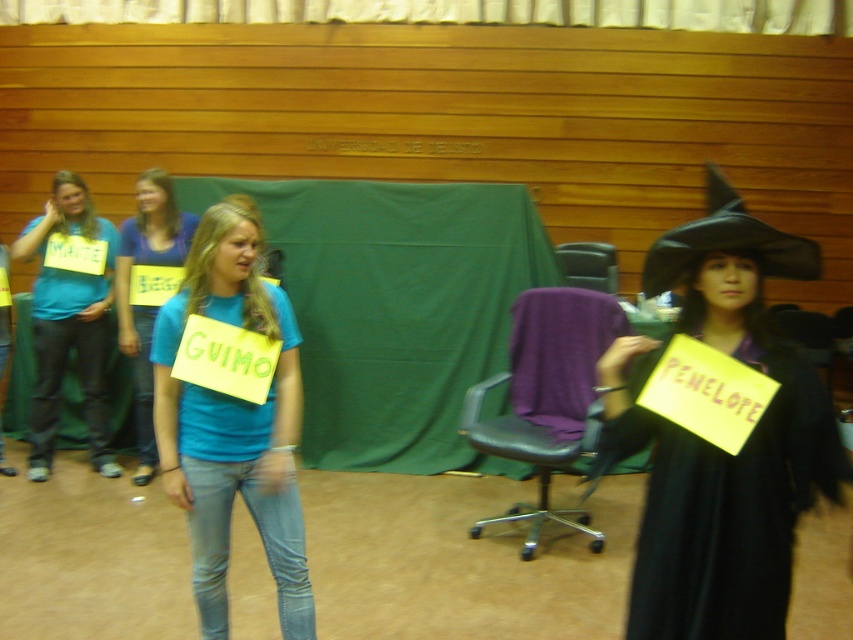
You are a photographer setting up for a group photo. You see the matte blue shirt at left and the black leather chair at center. Which object should you move closer to the camera to ensure both are in focus?

The matte blue shirt at left is much taller than the black leather chair at center, so you should move the black leather chair at center closer to the camera to ensure both are in focus.

You are a photographer setting up for a group photo. You notice the blue cotton shirt at center and the black felt witch hat at upper right. Which object should you adjust to ensure both are visible in the frame?

The blue cotton shirt at center is taller than the black felt witch hat at upper right, so you should lower the camera angle or adjust the framing to accommodate the height of the blue cotton shirt at center.

You are organizing a costume party and need to arrange the blue cotton shirt at center and the black felt witch hat at upper right for a photo. Which item should be placed on the left side to match the current arrangement?

The blue cotton shirt at center should be placed on the left side because it is positioned on the left side of the black felt witch hat at upper right in the current arrangement.